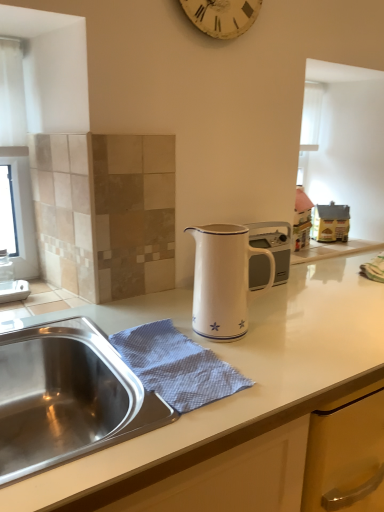
Question: Based on their sizes in the image, would you say blue textured cloth at sink is bigger or smaller than white enamel jug at center?

Choices:
 (A) small
 (B) big

Answer: (A)

Question: From a real-world perspective, is blue textured cloth at sink positioned above or below white enamel jug at center?

Choices:
 (A) above
 (B) below

Answer: (B)

Question: Which object is the closest to the white glossy pitcher at center?

Choices:
 (A) white enamel jug at center
 (B) white textured clock at upper center
 (C) blue textured cloth at sink

Answer: (C)

Question: Based on their relative distances, which object is nearer to the white enamel jug at center?

Choices:
 (A) blue textured cloth at sink
 (B) white textured clock at upper center
 (C) white glossy pitcher at center

Answer: (A)